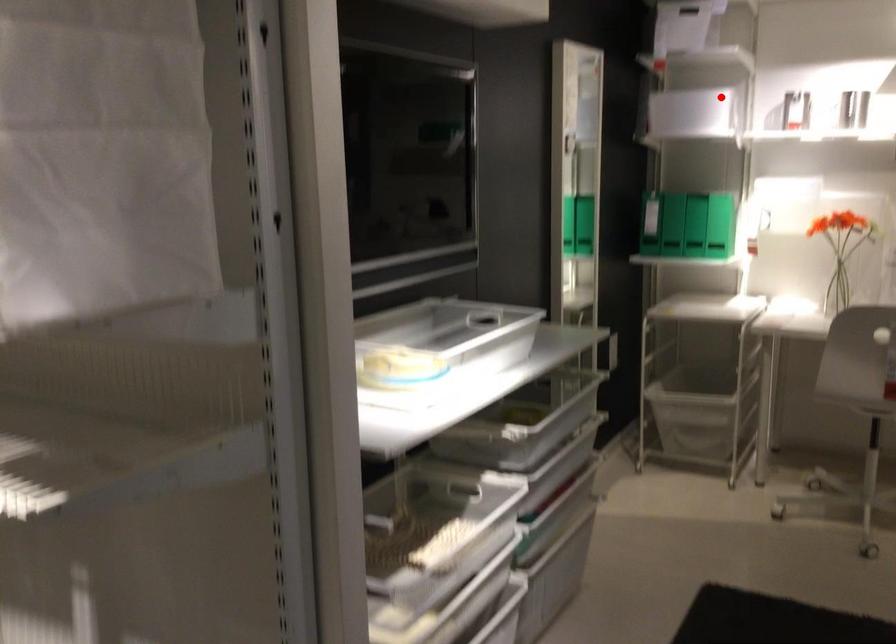
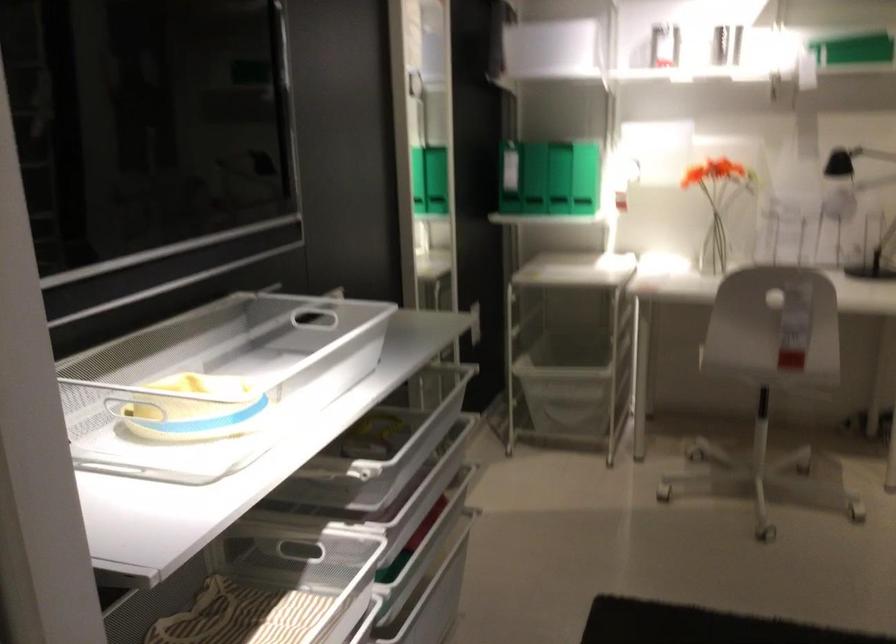
Locate, in the second image, the point that corresponds to the highlighted location in the first image.

(556, 46)